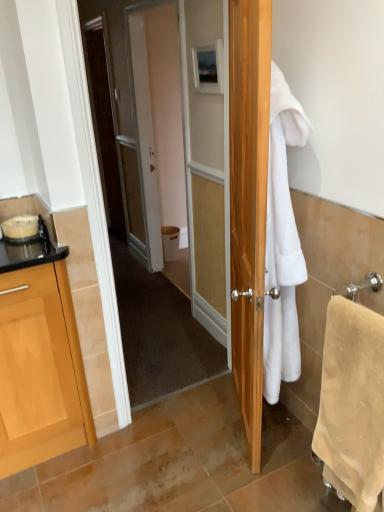
Question: From a real-world perspective, is white fluffy towel at right, which is the 1th towel/napkin from left to right, above or below beige soft towel at right, acting as the 1th towel/napkin starting from the right?

Choices:
 (A) below
 (B) above

Answer: (B)

Question: Is white fluffy towel at right, which is the 1th towel/napkin from left to right, situated inside beige soft towel at right, acting as the 1th towel/napkin starting from the right, or outside?

Choices:
 (A) outside
 (B) inside

Answer: (A)

Question: Which object is the closest to the matte wooden picture frame at upper center?

Choices:
 (A) white fluffy towel at right, which is the 1th towel/napkin from left to right
 (B) white plastic trash bin at center
 (C) beige soft towel at right, which is the 2th towel/napkin in left-to-right order

Answer: (A)

Question: Which object is positioned closest to the beige soft towel at right, acting as the 1th towel/napkin starting from the right?

Choices:
 (A) white fluffy towel at right, positioned as the 2th towel/napkin in right-to-left order
 (B) matte wooden picture frame at upper center
 (C) white plastic trash bin at center

Answer: (A)